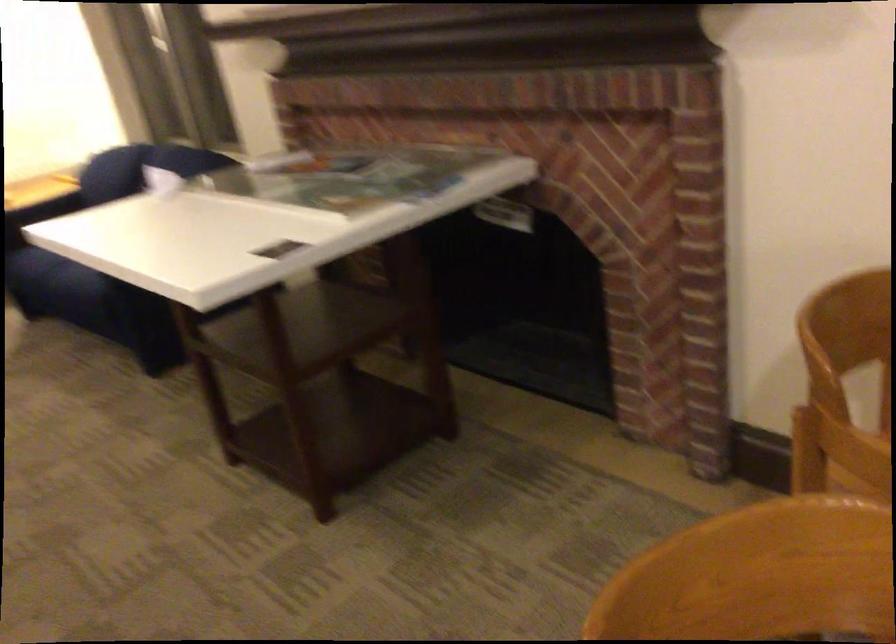
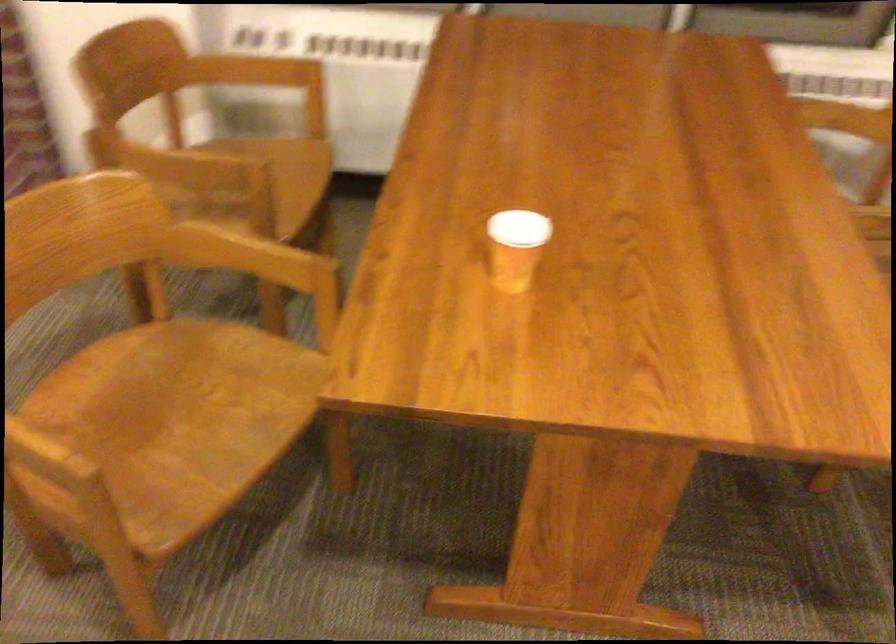
Based on the continuous images, in which direction is the camera rotating?

The camera rotated toward right-down.